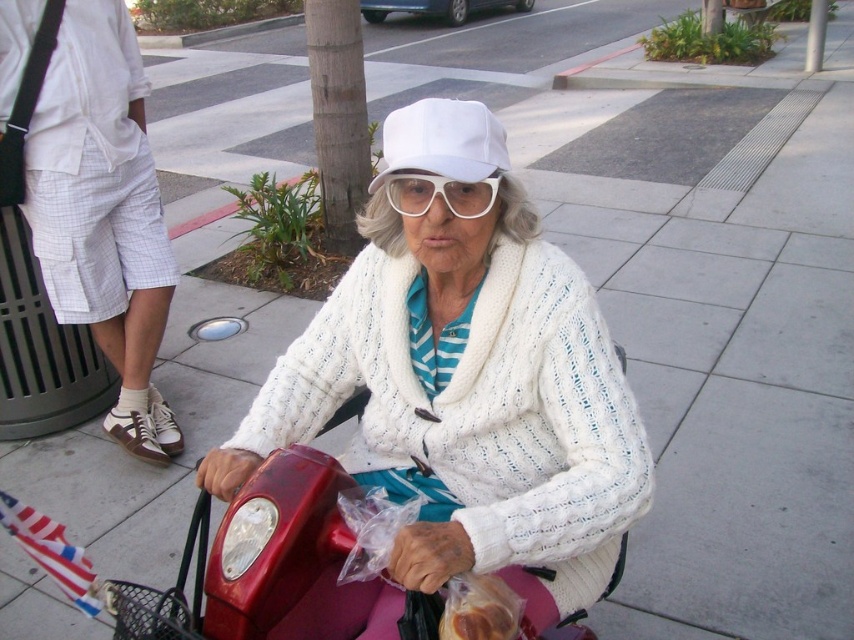
Who is more distant from viewer, (293, 342) or (440, 112)?

The point (293, 342) is more distant.

Is white knitted sweater at center thinner than white fabric baseball cap at center?

No.

Where is `white knitted sweater at center`? This screenshot has height=640, width=854. white knitted sweater at center is located at coordinates (466, 384).

Is white glossy bread at lower center positioned before white plastic goggles at center?

Yes, it is.

Can you confirm if white glossy bread at lower center is positioned to the right of white plastic goggles at center?

Indeed, white glossy bread at lower center is positioned on the right side of white plastic goggles at center.

Does point (518, 611) come in front of point (434, 189)?

Yes, point (518, 611) is in front of point (434, 189).

The image size is (854, 640). Identify the location of white glossy bread at lower center. (x=478, y=609).

Can you confirm if white knitted sweater at center is wider than white plastic goggles at center?

Yes.

Is white knitted sweater at center to the left of white plastic goggles at center from the viewer's perspective?

Indeed, white knitted sweater at center is positioned on the left side of white plastic goggles at center.

Is point (592, 592) farther from camera compared to point (389, 177)?

Yes, it is.

Locate an element on the screen. This screenshot has width=854, height=640. white knitted sweater at center is located at coordinates (466, 384).